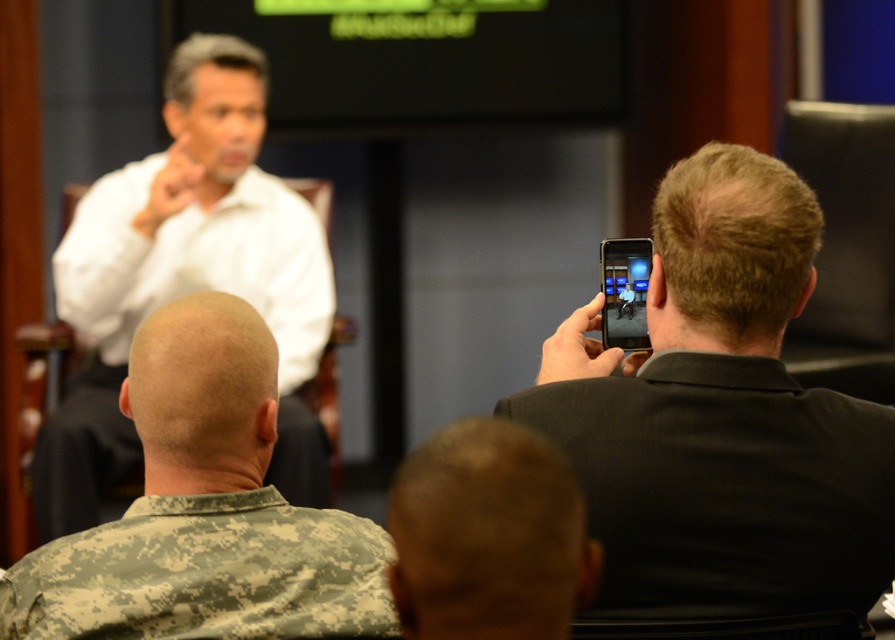
You are a photographer standing 1.5 meters away from the camera. You want to adjust the focus on the camouflage fabric at lower left. Can you reach the camera from your current position?

The camouflage fabric at lower left and camera are 1.51 meters apart. Since you are 1.5 meters away from the camera, you are just 1 centimeter too far to reach it.

You are a photographer trying to capture a clear photo of both camouflage uniform at lower left and camouflage uniform at lower center. Since you can only focus on one at a time, which one should you choose to ensure the subject is in focus and not blurred?

The camouflage uniform at lower left is larger in size compared to the camouflage uniform at lower center, so focusing on the camouflage uniform at lower left would ensure a clearer image due to its larger size taking up more of the frame.